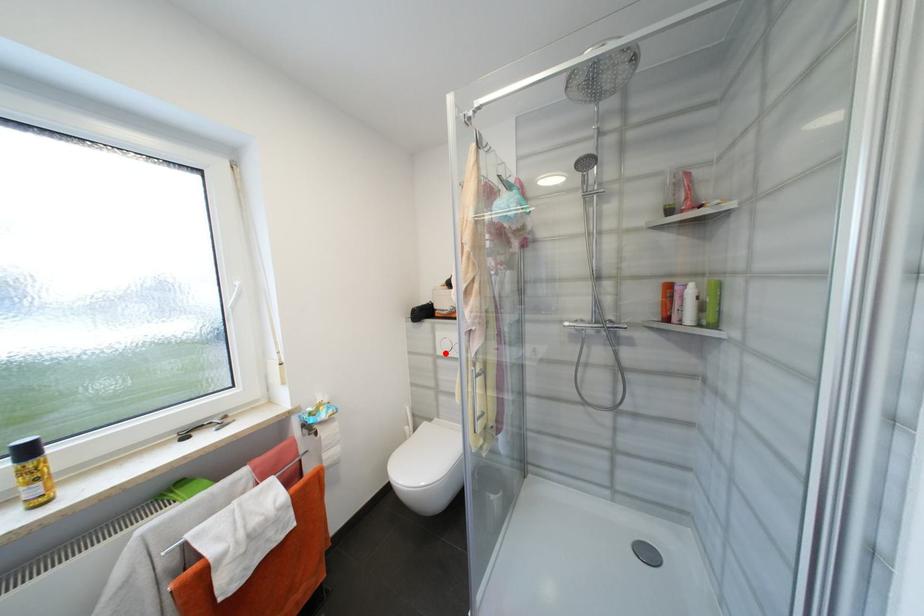
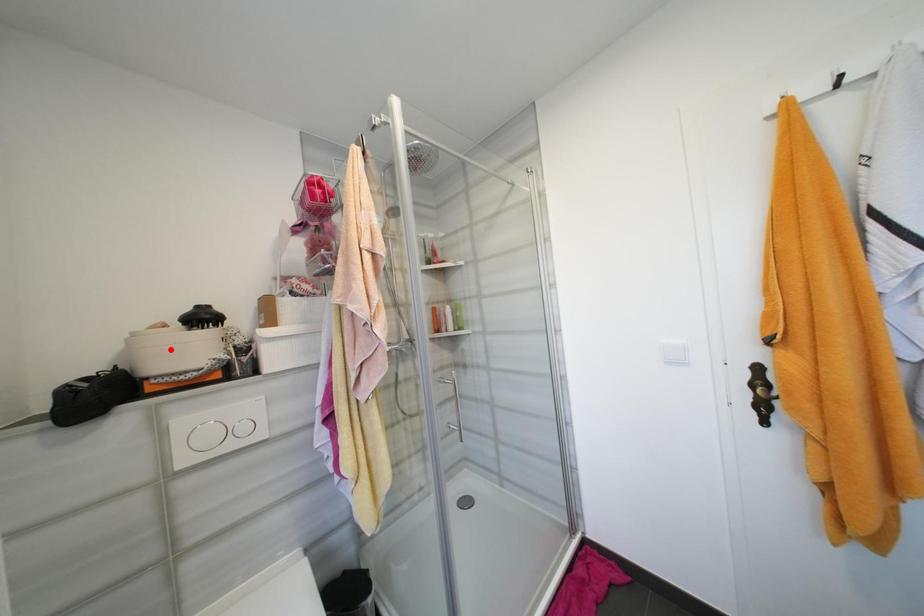
I am providing you with two images of the same scene from different viewpoints. A red point is marked on the first image and another point is marked on the second image. Is the red point in image1 aligned with the point shown in image2?

No